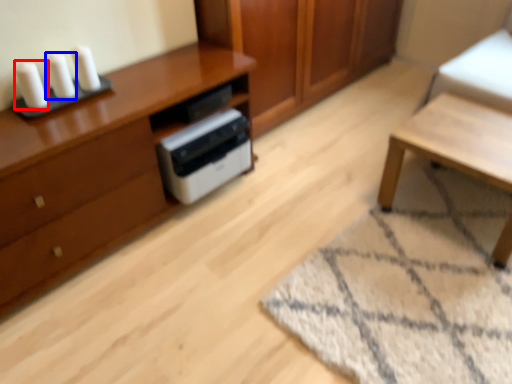
Question: Which point is closer to the camera, candle (highlighted by a red box) or candle (highlighted by a blue box)?

Choices:
 (A) candle
 (B) candle

Answer: (A)